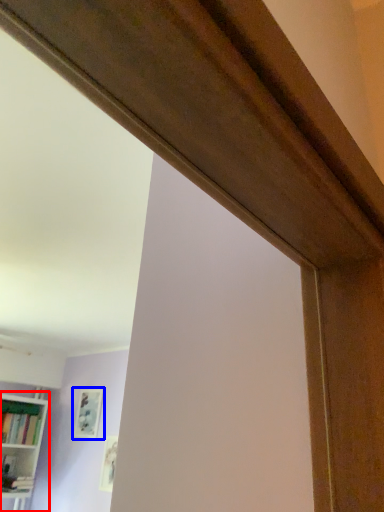
Question: Which point is further to the camera, bookcase (highlighted by a red box) or picture frame (highlighted by a blue box)?

Choices:
 (A) bookcase
 (B) picture frame

Answer: (B)